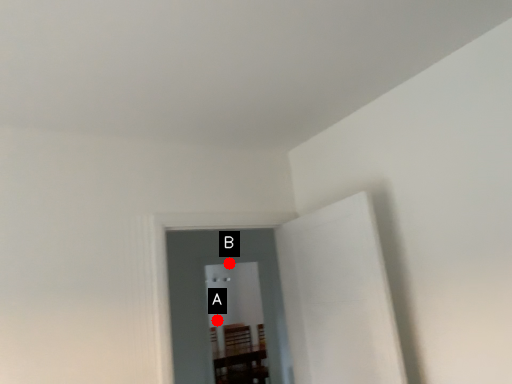
Question: Two points are circled on the image, labeled by A and B beside each circle. Which point is further to the camera?

Choices:
 (A) A is further
 (B) B is further

Answer: (A)